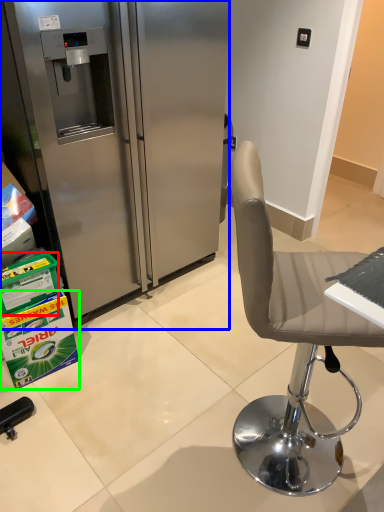
Question: Considering the real-world distances, which object is farthest from box (highlighted by a red box)? refrigerator (highlighted by a blue box) or box (highlighted by a green box)?

Choices:
 (A) refrigerator
 (B) box

Answer: (A)